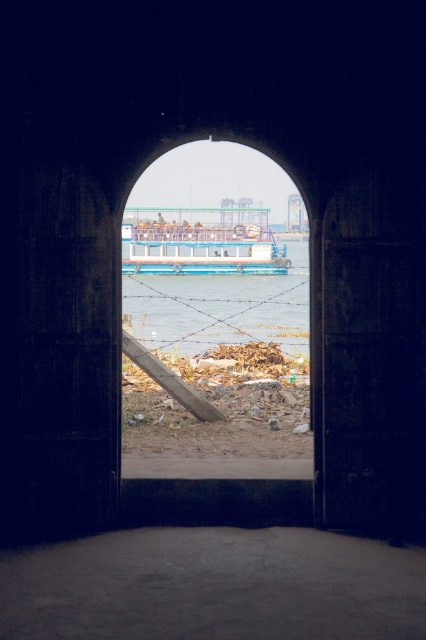
Does blue painted boat at center appear under clear water at center?

No.

Who is higher up, blue painted boat at center or clear water at center?

Positioned higher is blue painted boat at center.

Describe the element at coordinates (216, 316) in the screenshot. I see `blue painted boat at center` at that location.

Find the location of a particular element. The height and width of the screenshot is (640, 426). blue painted boat at center is located at coordinates (216, 316).

Which is more to the left, clear water at center or blue painted metal boat at center?

clear water at center is more to the left.

Who is higher up, clear water at center or blue painted metal boat at center?

Positioned higher is blue painted metal boat at center.

Identify the location of clear water at center. This screenshot has height=640, width=426. (216, 310).

At what (x,y) coordinates should I click in order to perform the action: click on clear water at center. Please return your answer as a coordinate pair (x, y). The height and width of the screenshot is (640, 426). Looking at the image, I should click on (216, 310).

Which is below, blue painted boat at center or blue painted metal boat at center?

blue painted boat at center is below.

Is blue painted boat at center shorter than blue painted metal boat at center?

No, blue painted boat at center is not shorter than blue painted metal boat at center.

The image size is (426, 640). What do you see at coordinates (216, 316) in the screenshot? I see `blue painted boat at center` at bounding box center [216, 316].

The width and height of the screenshot is (426, 640). In order to click on blue painted boat at center in this screenshot , I will do `click(216, 316)`.